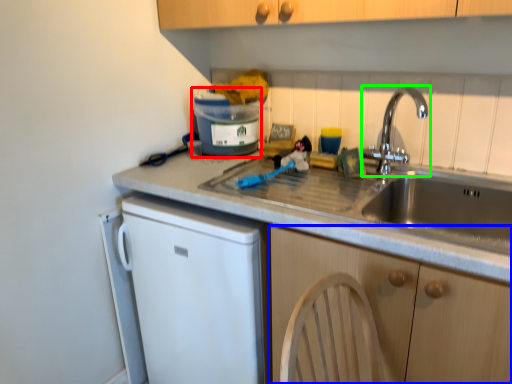
Question: Which object is positioned closest to appliance (highlighted by a red box)? Select from cabinetry (highlighted by a blue box) and tap (highlighted by a green box).

Choices:
 (A) cabinetry
 (B) tap

Answer: (B)